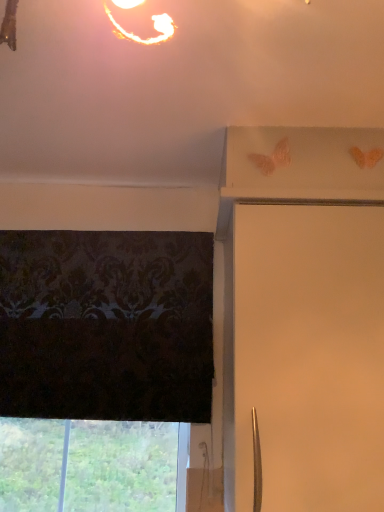
Question: Does transparent glass window at lower left have a greater width compared to white matte shutter at upper right?

Choices:
 (A) yes
 (B) no

Answer: (B)

Question: Is transparent glass window at lower left positioned far away from white matte shutter at upper right?

Choices:
 (A) no
 (B) yes

Answer: (A)

Question: Is transparent glass window at lower left in front of white matte shutter at upper right?

Choices:
 (A) no
 (B) yes

Answer: (A)

Question: From the image's perspective, is transparent glass window at lower left located beneath white matte shutter at upper right?

Choices:
 (A) yes
 (B) no

Answer: (A)

Question: Can you confirm if transparent glass window at lower left is bigger than white matte shutter at upper right?

Choices:
 (A) yes
 (B) no

Answer: (B)

Question: From a real-world perspective, is transparent glass window at lower left physically above white matte shutter at upper right?

Choices:
 (A) no
 (B) yes

Answer: (A)

Question: Can you confirm if white matte shutter at upper right is positioned to the left of transparent glass window at lower left?

Choices:
 (A) no
 (B) yes

Answer: (A)

Question: Would you say transparent glass window at lower left is part of white matte shutter at upper right's contents?

Choices:
 (A) no
 (B) yes

Answer: (A)

Question: Is white matte shutter at upper right taller than transparent glass window at lower left?

Choices:
 (A) yes
 (B) no

Answer: (A)

Question: Does white matte shutter at upper right appear on the right side of transparent glass window at lower left?

Choices:
 (A) no
 (B) yes

Answer: (B)

Question: Does white matte shutter at upper right have a lesser height compared to transparent glass window at lower left?

Choices:
 (A) yes
 (B) no

Answer: (B)

Question: Is transparent glass window at lower left at the back of white matte shutter at upper right?

Choices:
 (A) no
 (B) yes

Answer: (A)

Question: Considering the positions of white matte shutter at upper right and transparent glass window at lower left in the image, is white matte shutter at upper right wider or thinner than transparent glass window at lower left?

Choices:
 (A) wide
 (B) thin

Answer: (A)